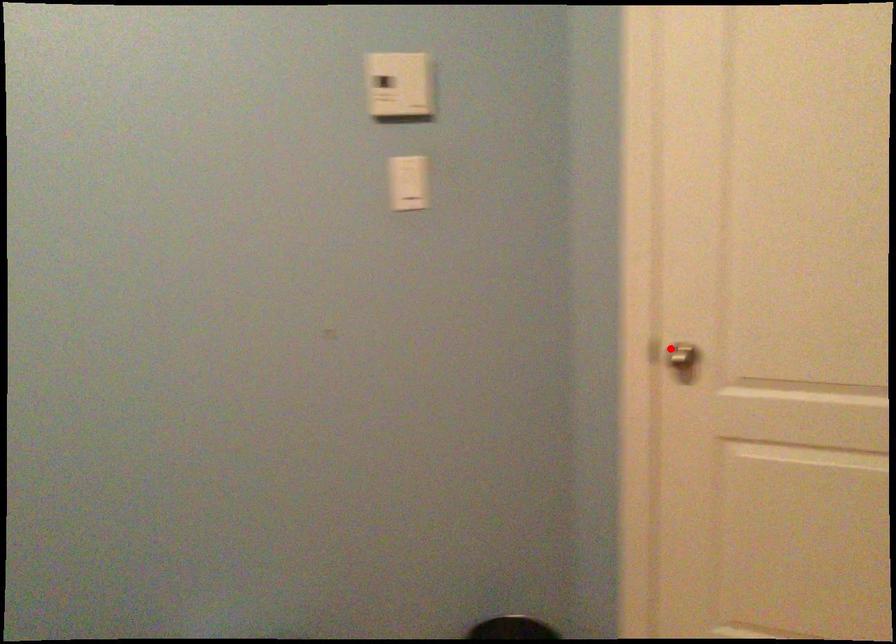
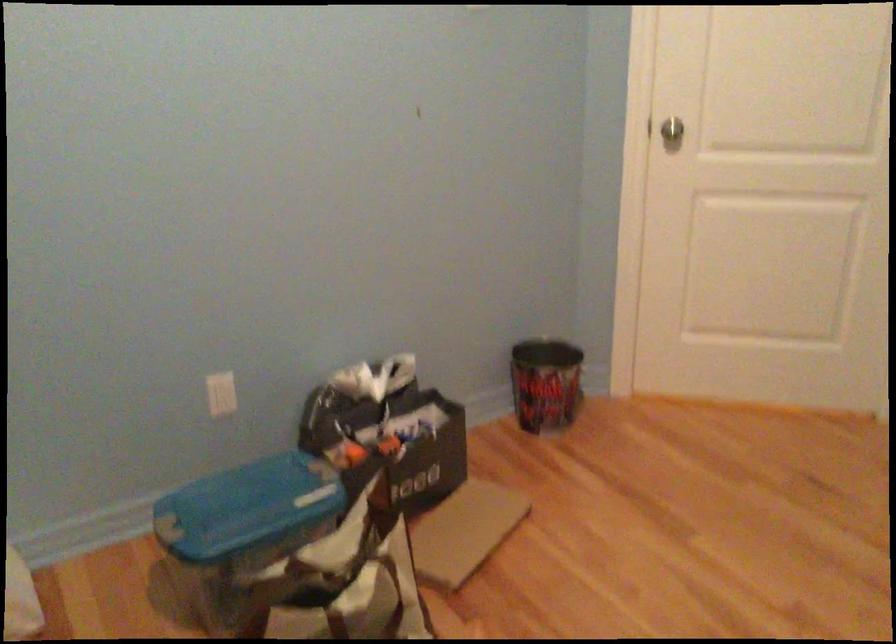
Question: I am providing you with two images of the same scene from different viewpoints. A red point is marked on the first image. Is the red point's position out of view in image 2?

Choices:
 (A) Yes
 (B) No

Answer: (B)